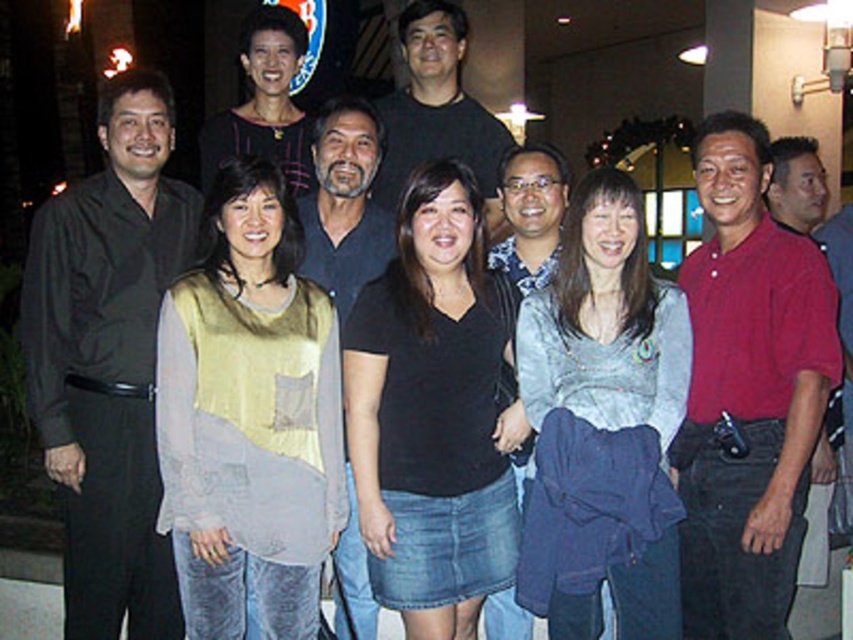
Question: Estimate the real-world distances between objects in this image. Which object is closer to the dark gray shirt at center?

Choices:
 (A) black matte shirt at center
 (B) blue patterned shirt at center

Answer: (B)

Question: Can you confirm if black matte shirt at center is wider than blue patterned shirt at center?

Choices:
 (A) yes
 (B) no

Answer: (A)

Question: Is matte red polo shirt at right closer to the viewer compared to blue patterned shirt at center?

Choices:
 (A) yes
 (B) no

Answer: (A)

Question: Among these points, which one is farthest from the camera?

Choices:
 (A) (257, 65)
 (B) (428, 16)
 (C) (509, 349)

Answer: (A)

Question: Which is nearer to the light gray sheer top at center?

Choices:
 (A) matte red polo shirt at right
 (B) black matte shirt at center
 (C) black smooth shirt at left

Answer: (B)

Question: Does black matte shirt at center appear on the left side of blue patterned shirt at center?

Choices:
 (A) yes
 (B) no

Answer: (A)